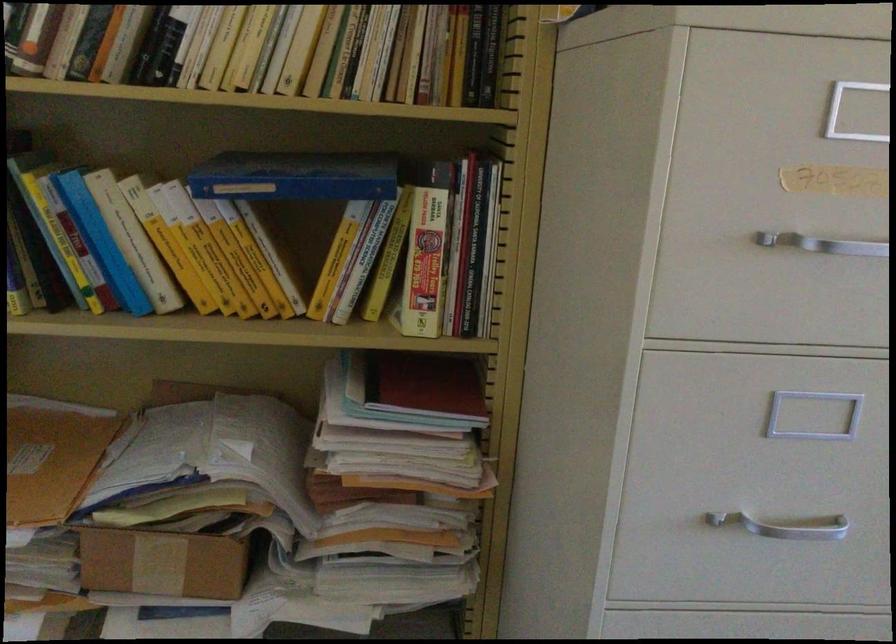
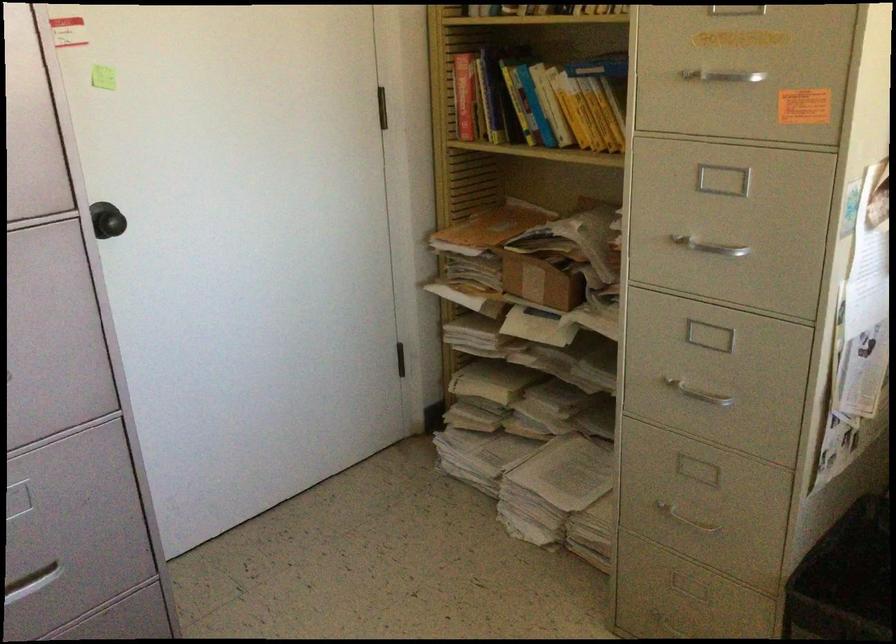
Locate, in the second image, the point that corresponds to pixel 780 523 in the first image.

(710, 248)